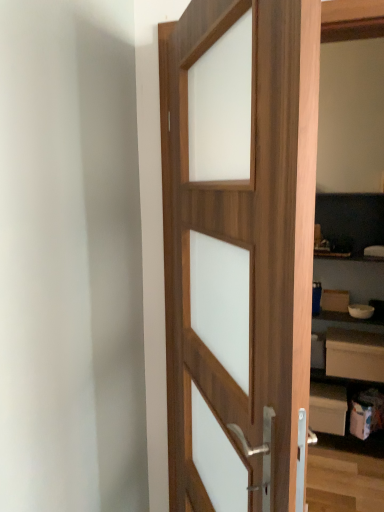
Question: Is white matte drawer at lower right thinner than white matte bookshelf at right?

Choices:
 (A) yes
 (B) no

Answer: (A)

Question: From the image's perspective, does white matte drawer at lower right appear lower than white matte bookshelf at right?

Choices:
 (A) yes
 (B) no

Answer: (A)

Question: Would you consider white matte drawer at lower right to be distant from white matte bookshelf at right?

Choices:
 (A) no
 (B) yes

Answer: (A)

Question: Is the depth of white matte drawer at lower right greater than that of white matte bookshelf at right?

Choices:
 (A) yes
 (B) no

Answer: (A)

Question: Is white matte drawer at lower right to the right of white matte bookshelf at right from the viewer's perspective?

Choices:
 (A) no
 (B) yes

Answer: (B)

Question: Considering their positions, is white matte drawer at lower right located in front of or behind wooden door at center?

Choices:
 (A) behind
 (B) front

Answer: (A)

Question: Do you think white matte drawer at lower right is within wooden door at center, or outside of it?

Choices:
 (A) outside
 (B) inside

Answer: (A)

Question: Is white matte drawer at lower right wider or thinner than wooden door at center?

Choices:
 (A) thin
 (B) wide

Answer: (B)

Question: Is white matte drawer at lower right bigger or smaller than wooden door at center?

Choices:
 (A) big
 (B) small

Answer: (B)

Question: Looking at their shapes, would you say white matte drawer at lower right is wider or thinner than white matte bookshelf at right?

Choices:
 (A) wide
 (B) thin

Answer: (B)

Question: From the image's perspective, relative to white matte bookshelf at right, is white matte drawer at lower right above or below?

Choices:
 (A) below
 (B) above

Answer: (A)

Question: Is white matte drawer at lower right taller or shorter than white matte bookshelf at right?

Choices:
 (A) short
 (B) tall

Answer: (A)

Question: Based on their sizes in the image, would you say white matte drawer at lower right is bigger or smaller than white matte bookshelf at right?

Choices:
 (A) small
 (B) big

Answer: (A)

Question: Would you say white matte bookshelf at right is inside or outside white matte drawer at lower right?

Choices:
 (A) inside
 (B) outside

Answer: (B)

Question: Considering the positions of white matte bookshelf at right and white matte drawer at lower right in the image, is white matte bookshelf at right bigger or smaller than white matte drawer at lower right?

Choices:
 (A) big
 (B) small

Answer: (A)